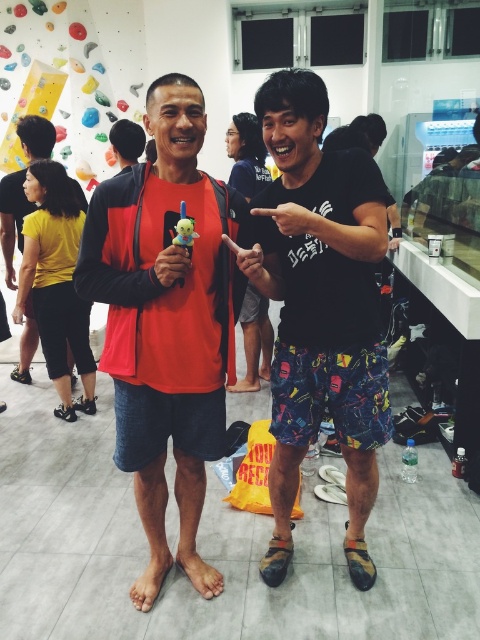
Is black matte shorts at center to the right of matte orange tank top at center from the viewer's perspective?

Correct, you'll find black matte shorts at center to the right of matte orange tank top at center.

Where is `black matte shorts at center`? Image resolution: width=480 pixels, height=640 pixels. black matte shorts at center is located at coordinates (320, 307).

Consider the image. Can you confirm if matte orange shirt at center is smaller than black matte shorts at center?

Yes, matte orange shirt at center is smaller than black matte shorts at center.

Between matte orange shirt at center and black matte shorts at center, which one appears on the left side from the viewer's perspective?

Positioned to the left is matte orange shirt at center.

Locate an element on the screen. This screenshot has height=640, width=480. matte orange shirt at center is located at coordinates (167, 323).

In the scene shown: Does matte orange shirt at center have a smaller size compared to matte orange tank top at center?

Yes.

Identify the location of matte orange shirt at center. The image size is (480, 640). (167, 323).

Does point (191, 534) come behind point (12, 241)?

No, it is in front of (12, 241).

Identify the location of matte orange shirt at center. The width and height of the screenshot is (480, 640). (167, 323).